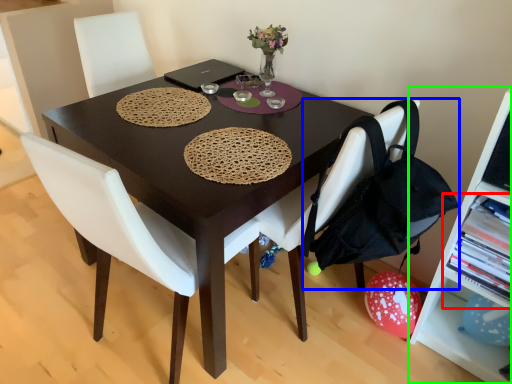
Question: Based on their relative distances, which object is farther from shelf (highlighted by a red box)? Choose from handbag (highlighted by a blue box) and shelf (highlighted by a green box).

Choices:
 (A) handbag
 (B) shelf

Answer: (A)